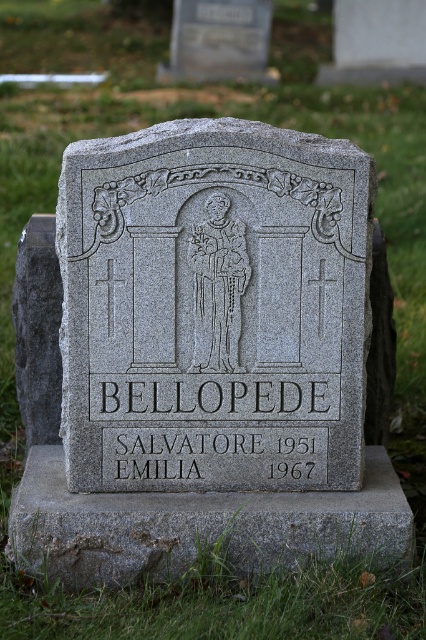
Is gray granite gravestone at center taller than gray stone statue at center?

Correct, gray granite gravestone at center is much taller as gray stone statue at center.

Is gray granite gravestone at center bigger than gray stone statue at center?

Correct, gray granite gravestone at center is larger in size than gray stone statue at center.

Identify the location of gray granite gravestone at center. This screenshot has height=640, width=426. (213, 308).

Where is `gray granite gravestone at center`? gray granite gravestone at center is located at coordinates (213, 308).